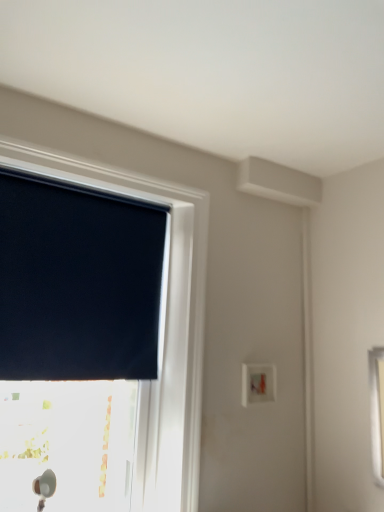
Question: Is white plastic light switch at center-right far away from dark blue fabric at upper left?

Choices:
 (A) no
 (B) yes

Answer: (B)

Question: Is white plastic light switch at center-right outside dark blue fabric at upper left?

Choices:
 (A) no
 (B) yes

Answer: (B)

Question: Is white plastic light switch at center-right bigger than dark blue fabric at upper left?

Choices:
 (A) yes
 (B) no

Answer: (B)

Question: Is white plastic light switch at center-right thinner than dark blue fabric at upper left?

Choices:
 (A) no
 (B) yes

Answer: (A)

Question: Is white plastic light switch at center-right oriented towards dark blue fabric at upper left?

Choices:
 (A) no
 (B) yes

Answer: (A)

Question: Is white plastic light switch at center-right surrounding dark blue fabric at upper left?

Choices:
 (A) yes
 (B) no

Answer: (B)

Question: Does black matte window at upper left have a greater height compared to dark blue fabric at upper left?

Choices:
 (A) no
 (B) yes

Answer: (B)

Question: Considering the relative positions of black matte window at upper left and dark blue fabric at upper left in the image provided, is black matte window at upper left to the right of dark blue fabric at upper left from the viewer's perspective?

Choices:
 (A) no
 (B) yes

Answer: (B)

Question: Is the position of black matte window at upper left less distant than that of dark blue fabric at upper left?

Choices:
 (A) yes
 (B) no

Answer: (A)

Question: Is black matte window at upper left outside dark blue fabric at upper left?

Choices:
 (A) no
 (B) yes

Answer: (B)

Question: Is black matte window at upper left turned away from dark blue fabric at upper left?

Choices:
 (A) yes
 (B) no

Answer: (A)

Question: Could you tell me if black matte window at upper left is facing dark blue fabric at upper left?

Choices:
 (A) no
 (B) yes

Answer: (B)

Question: Is dark blue fabric at upper left at the right side of black matte window at upper left?

Choices:
 (A) no
 (B) yes

Answer: (A)